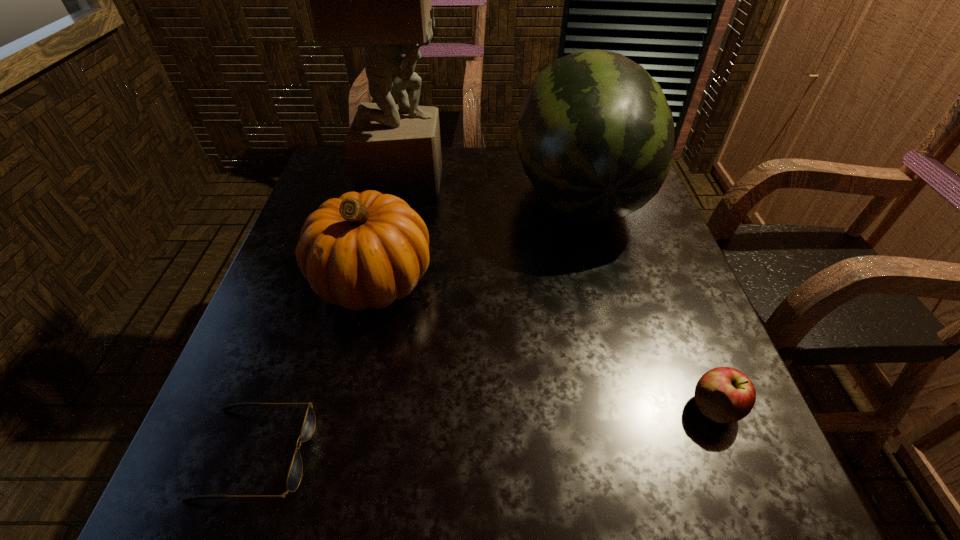
What are the coordinates of `object that is at the far right corner` in the screenshot? It's located at click(595, 136).

This screenshot has width=960, height=540. Identify the location of vacant space at the near edge of the desktop. (347, 501).

The height and width of the screenshot is (540, 960). In the image, there is a desktop. In order to click on vacant space at the left edge in this screenshot , I will do `click(301, 296)`.

The image size is (960, 540). In the image, there is a desktop. What are the coordinates of `free space at the right edge` in the screenshot? It's located at tap(652, 343).

Where is `free space at the far left corner of the desktop`? The image size is (960, 540). free space at the far left corner of the desktop is located at coordinates (331, 159).

This screenshot has width=960, height=540. In order to click on vacant area at the near right corner of the desktop in this screenshot , I will do `click(779, 508)`.

You are a GUI agent. You are given a task and a screenshot of the screen. Output one action in this format:
    pyautogui.click(x=<x>, y=<y>)
    Task: Click on the empty space that is in between the fourth tallest object and the pumpkin
    
    Given the screenshot: What is the action you would take?
    pyautogui.click(x=544, y=344)

Locate an element on the screen. This screenshot has width=960, height=540. blank region between the tallest object and the apple is located at coordinates point(560,293).

Locate an element on the screen. The image size is (960, 540). free space between the third shortest object and the watermelon is located at coordinates (476, 237).

Identify the location of free space that is in between the third tallest object and the shortest object. (315, 367).